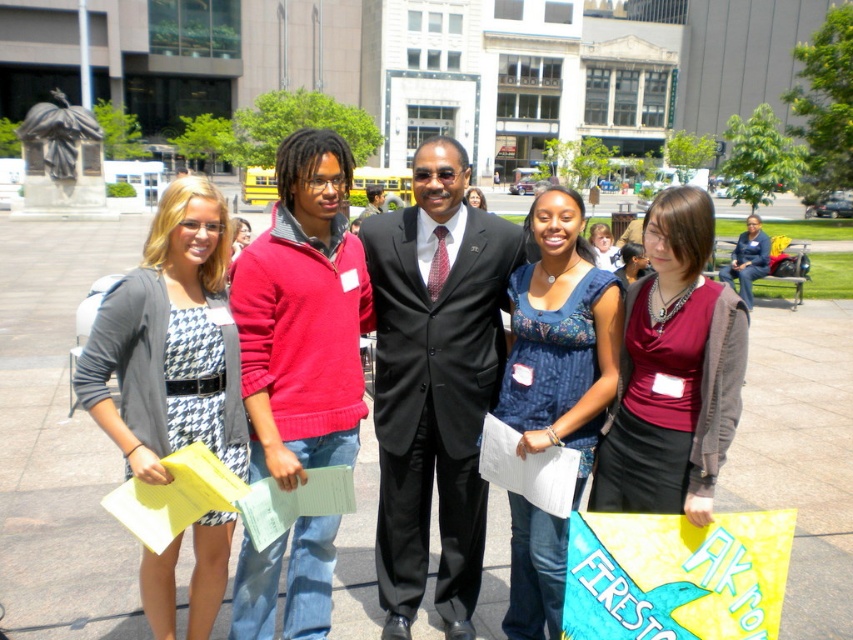
You are organizing a group photo and need to arrange the dark gray suit at center and the matte black dress at center so that they are side by side. Given their widths, which one should be placed on the left to ensure there is enough space between them?

The dark gray suit at center is wider than the matte black dress at center. To ensure enough space between them when placed side by side, the wider dark gray suit at center should be placed on the left so that the narrower matte black dress at center can fit comfortably on the right.

You are standing at the point marked by the coordinate point at point (741, 298). You want to move to the statue of liberty in the background. Which direction should you walk to reach the statue of liberty?

The statue of liberty is in the background, so you should walk forward from the point marked by the coordinate point at point (741, 298) to reach it.

From the picture: You are a photographer standing at the origin point of the coordinate system. You need to take a photo of the dark gray suit at center. What are the coordinates where you should aim your camera?

The coordinates to aim your camera are at point (747, 259).